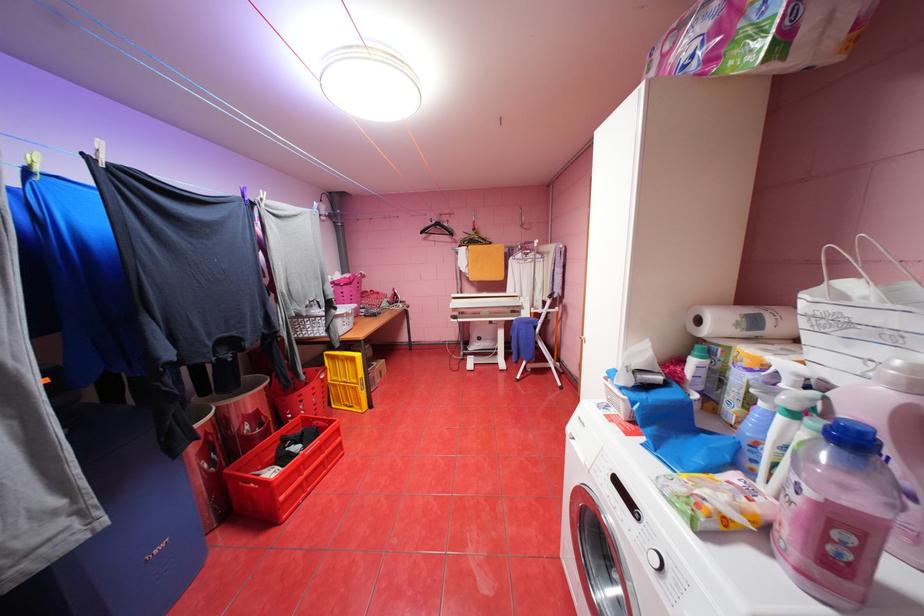
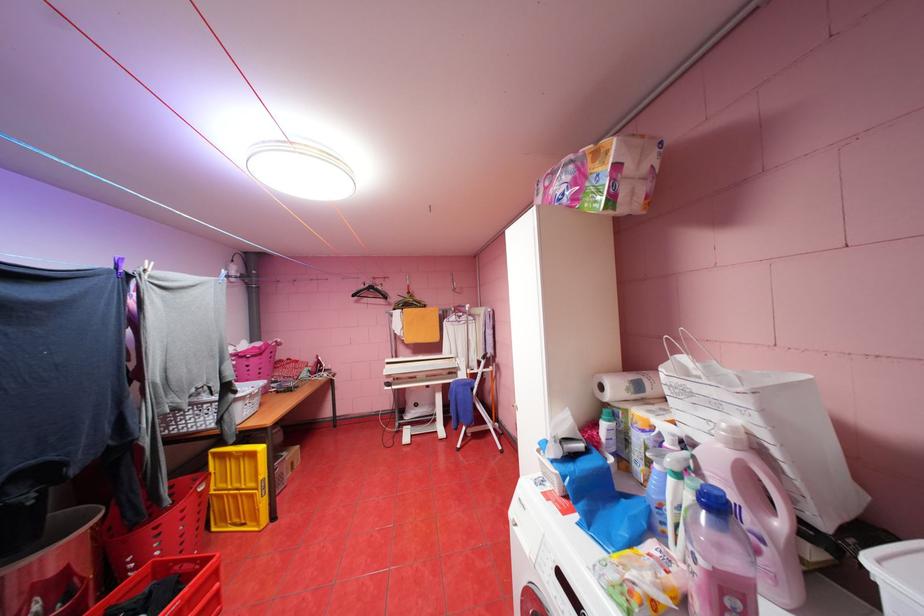
In the second image, find the point that corresponds to (x=708, y=321) in the first image.

(610, 387)